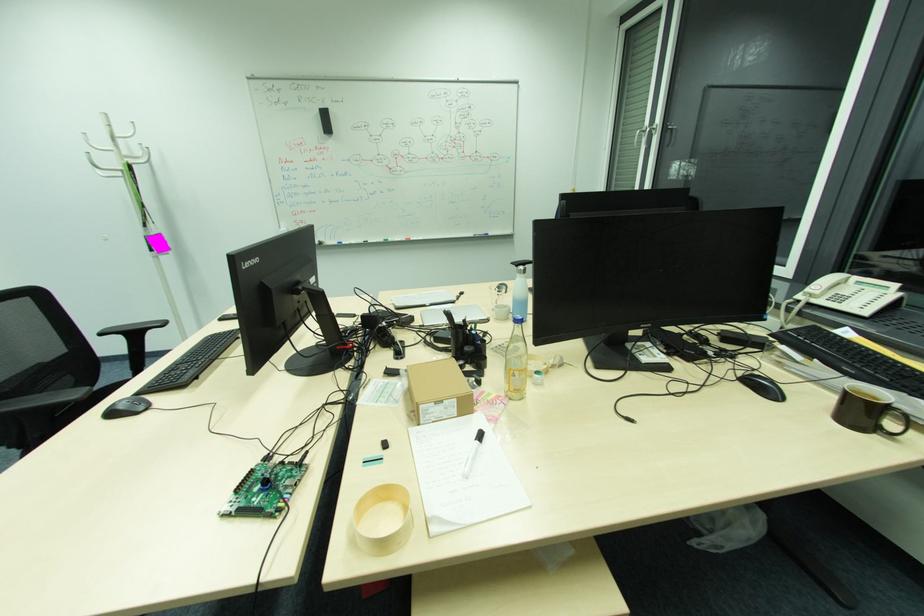
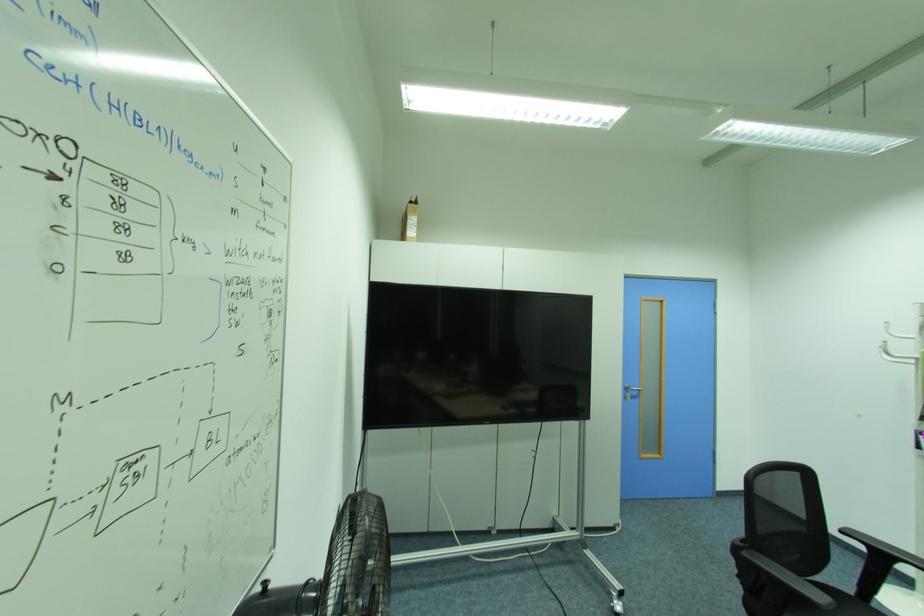
In the second image, find the point that corresponds to the point at 106,334 in the first image.

(846, 532)